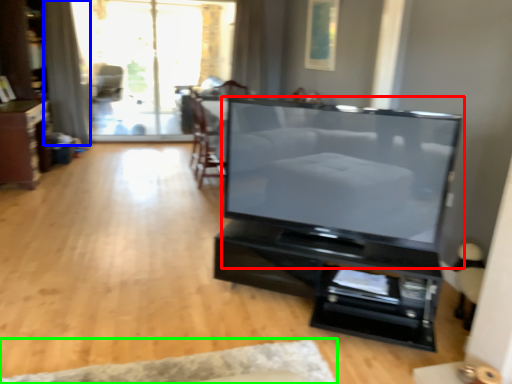
Question: Which object is the closest to the television (highlighted by a red box)? Choose among these: curtain (highlighted by a blue box) or plain (highlighted by a green box).

Choices:
 (A) curtain
 (B) plain

Answer: (B)